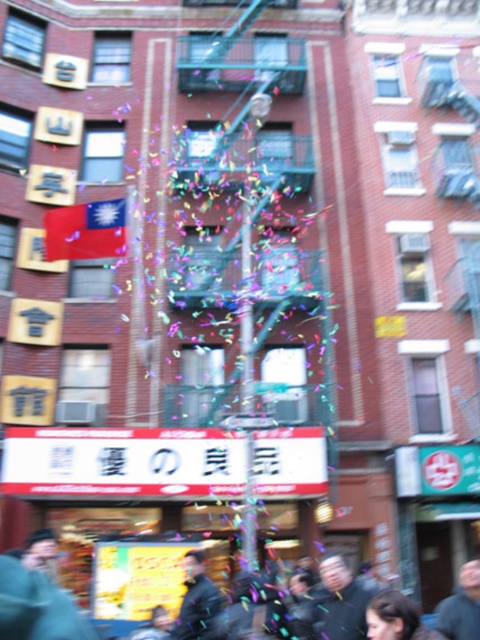
Does dark gray leather jacket at center appear over dark brown hair at center?

No.

Does dark gray leather jacket at center have a larger size compared to dark brown hair at center?

Incorrect, dark gray leather jacket at center is not larger than dark brown hair at center.

In the scene shown: Who is more forward, [207,625] or [372,625]?

Point [372,625]

Locate an element on the screen. The image size is (480, 640). dark gray leather jacket at center is located at coordinates (196, 600).

Who is more forward, (x=331, y=566) or (x=407, y=621)?

Point (x=407, y=621) is in front.

Does dark gray jacket at center appear on the left side of dark brown hair at center?

Indeed, dark gray jacket at center is positioned on the left side of dark brown hair at center.

Identify the location of dark gray jacket at center. (338, 602).

In order to click on dark gray jacket at center in this screenshot , I will do `click(338, 602)`.

Can you confirm if dark gray jacket at center is thinner than dark gray leather jacket at center?

Incorrect, dark gray jacket at center's width is not less than dark gray leather jacket at center's.

Does dark gray jacket at center lie in front of dark gray leather jacket at center?

Yes.

Is point (316, 618) in front of point (212, 602)?

Yes, point (316, 618) is in front of point (212, 602).

The image size is (480, 640). Identify the location of dark gray jacket at center. (338, 602).